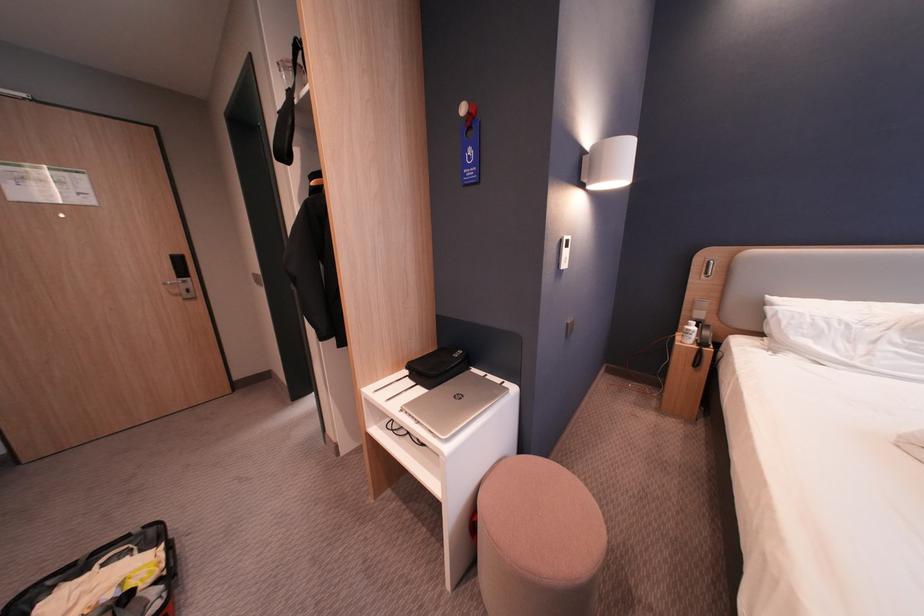
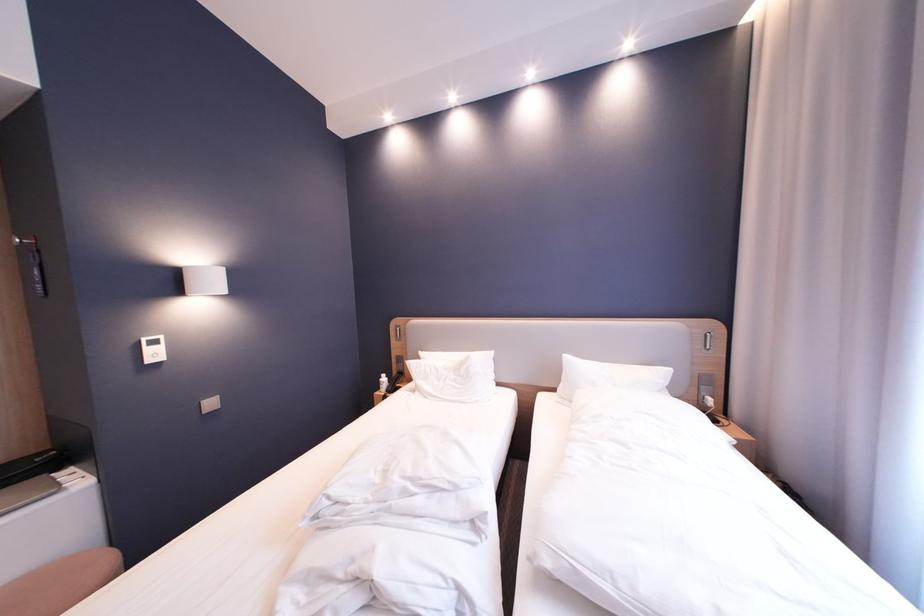
Find the pixel in the second image that matches (x=467, y=357) in the first image.

(51, 460)